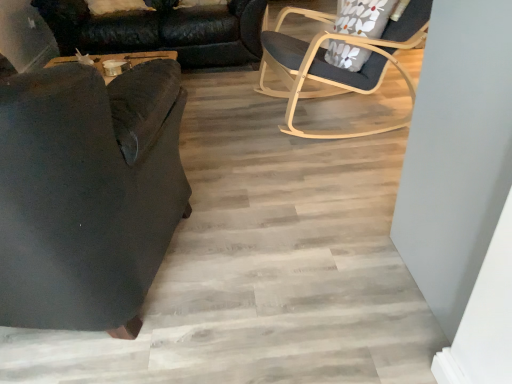
Question: Looking at the image, does black leather couch at left seem bigger or smaller compared to light wood/transparentobject at upper right, which is the 2th chair in front-to-back order?

Choices:
 (A) big
 (B) small

Answer: (A)

Question: Does point (67, 44) appear closer or farther from the camera than point (376, 87)?

Choices:
 (A) farther
 (B) closer

Answer: (A)

Question: Which is nearer to the dark fabric chair at left, which is counted as the 2th chair, starting from the back?

Choices:
 (A) floral fabric pillow at upper right
 (B) black leather couch at left
 (C) light wood/transparentobject at upper right, the second chair viewed from the left

Answer: (C)

Question: Estimate the real-world distances between objects in this image. Which object is farther from the floral fabric pillow at upper right?

Choices:
 (A) light wood/transparentobject at upper right, which is the 2th chair in front-to-back order
 (B) dark fabric chair at left, which ranks as the 2th chair in right-to-left order
 (C) black leather couch at left

Answer: (B)